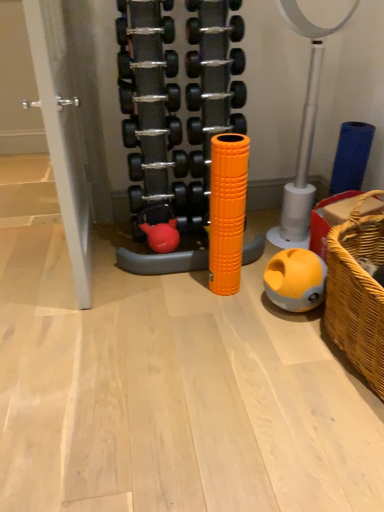
The image size is (384, 512). Find the location of `space that is in front of orange rubber foam roller at center, which is the 1th toy in top-to-bottom order`. space that is in front of orange rubber foam roller at center, which is the 1th toy in top-to-bottom order is located at coordinates (180, 316).